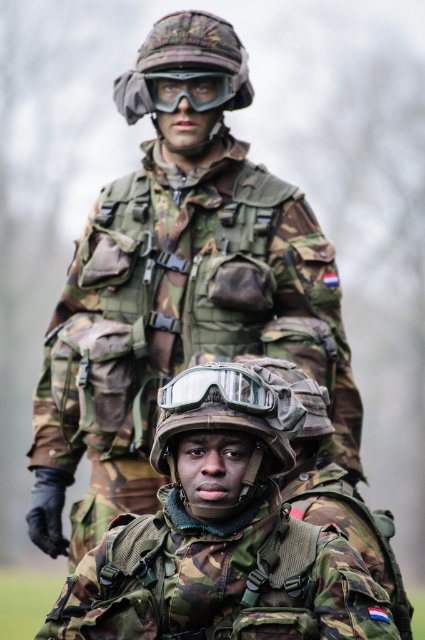
From the picture: You are a photographer adjusting your camera settings to capture the two military personnel in the scene. You notice the camouflage uniform at center and the camouflage fabric helmet at center. Which object should you focus on first if you want to ensure both are in sharp focus?

The camouflage uniform at center is much taller than the camouflage fabric helmet at center, so focusing on the camouflage uniform at center first would help ensure both are in sharp focus since it is the larger subject.

You are a photographer adjusting your camera settings to capture the scene. You notice the camouflage fabric helmet at lower center and the matte black goggles at center. Which object should you focus on first to ensure both are in sharp focus, considering their positions?

The camouflage fabric helmet at lower center is located below matte black goggles at center. Since the helmet is lower, it is closer to the camera, so focusing on the camouflage fabric helmet at lower center first would ensure both are in sharp focus.

In the image of two military personnel, where is the camouflage fabric helmet at lower center positioned relative to the camouflage fabric helmet at upper center?

The camouflage fabric helmet at lower center is positioned to the right of the camouflage fabric helmet at upper center.